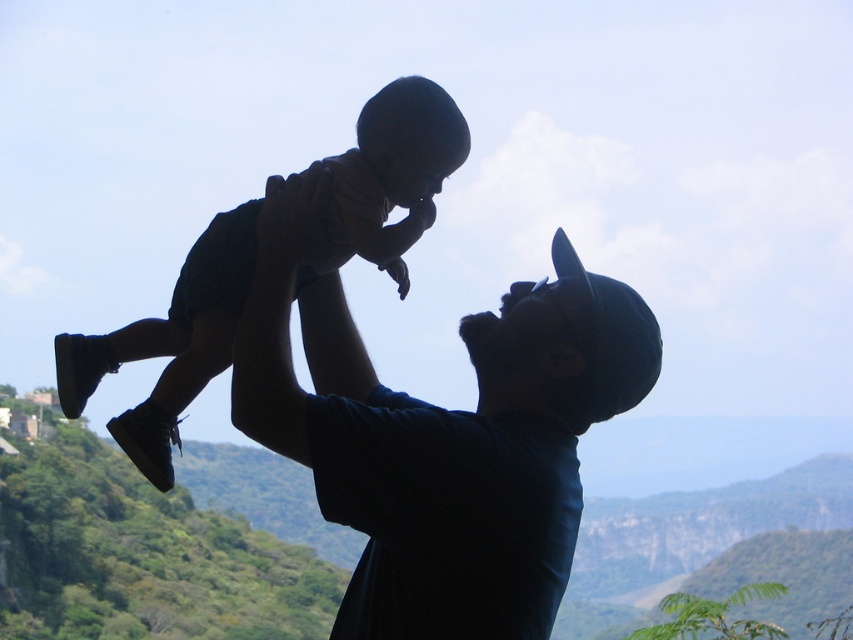
Who is more forward, (547,557) or (166,476)?

Point (547,557) is more forward.

You are a GUI agent. You are given a task and a screenshot of the screen. Output one action in this format:
    pyautogui.click(x=<x>, y=<y>)
    Task: Click on the dark blue shirt at upper center
    Image resolution: width=853 pixels, height=640 pixels.
    Given the screenshot: What is the action you would take?
    pyautogui.click(x=440, y=435)